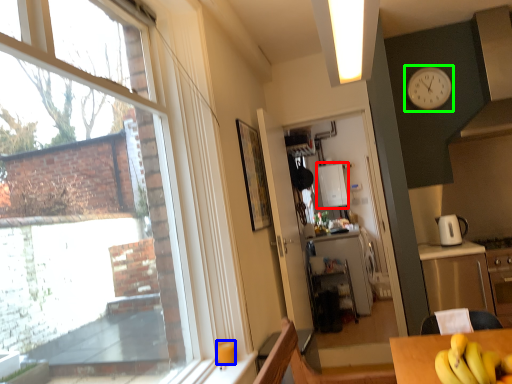
Question: Which object is positioned farthest from appliance (highlighted by a red box)? Select from coffee cup (highlighted by a blue box) and clock (highlighted by a green box).

Choices:
 (A) coffee cup
 (B) clock

Answer: (A)